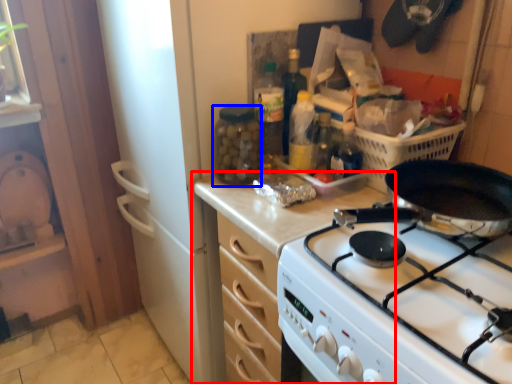
Question: Which object is closer to the camera taking this photo, cabinetry (highlighted by a red box) or bottle (highlighted by a blue box)?

Choices:
 (A) cabinetry
 (B) bottle

Answer: (A)